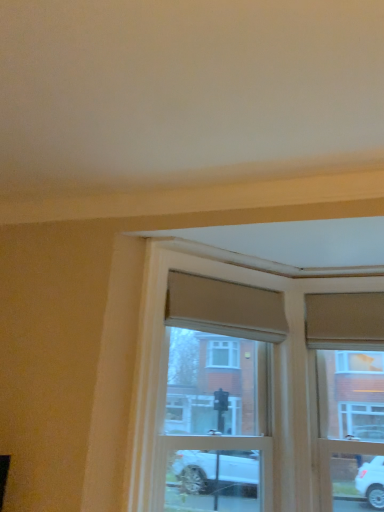
What is the approximate width of wooden window frame at upper right?

The width of wooden window frame at upper right is 7.80 inches.

At what (x,y) coordinates should I click in order to perform the action: click on wooden window frame at upper right. Please return your answer as a coordinate pair (x, y). Looking at the image, I should click on (350, 430).

What do you see at coordinates (350, 430) in the screenshot? This screenshot has width=384, height=512. I see `wooden window frame at upper right` at bounding box center [350, 430].

The image size is (384, 512). What are the coordinates of `wooden window frame at center` in the screenshot? It's located at (275, 368).

The height and width of the screenshot is (512, 384). What do you see at coordinates (275, 368) in the screenshot?
I see `wooden window frame at center` at bounding box center [275, 368].

You are a GUI agent. You are given a task and a screenshot of the screen. Output one action in this format:
    pyautogui.click(x=<x>, y=<y>)
    Task: Click on the wooden window frame at upper right
    
    Given the screenshot: What is the action you would take?
    pyautogui.click(x=350, y=430)

Would you say wooden window frame at upper right is to the left or to the right of wooden window frame at center in the picture?

Clearly, wooden window frame at upper right is on the right of wooden window frame at center in the image.

Between wooden window frame at upper right and wooden window frame at center, which one is positioned behind?

wooden window frame at upper right is further from the camera.

Is point (328, 395) in front of point (288, 490)?

That is False.

From the image's perspective, is wooden window frame at upper right beneath wooden window frame at center?

Correct, wooden window frame at upper right appears lower than wooden window frame at center in the image.

From a real-world perspective, is wooden window frame at upper right physically located above or below wooden window frame at center?

From a real-world perspective, wooden window frame at upper right is physically above wooden window frame at center.

Considering the sizes of wooden window frame at upper right and wooden window frame at center in the image, is wooden window frame at upper right wider or thinner than wooden window frame at center?

wooden window frame at upper right is thinner than wooden window frame at center.

Is wooden window frame at upper right shorter than wooden window frame at center?

Yes.

Considering the sizes of objects wooden window frame at upper right and wooden window frame at center in the image provided, who is bigger, wooden window frame at upper right or wooden window frame at center?

Bigger between the two is wooden window frame at center.

Is wooden window frame at center inside wooden window frame at upper right?

No, wooden window frame at center is not a part of wooden window frame at upper right.

Looking at this image, can you see wooden window frame at upper right touching wooden window frame at center?

There is a gap between wooden window frame at upper right and wooden window frame at center.

Is wooden window frame at upper right facing towards wooden window frame at center?

No, wooden window frame at upper right does not turn towards wooden window frame at center.

How different are the orientations of wooden window frame at upper right and wooden window frame at center in degrees?

The angle between the facing direction of wooden window frame at upper right and the facing direction of wooden window frame at center is 47.9 degrees.

How distant is wooden window frame at upper right from wooden window frame at center?

wooden window frame at upper right and wooden window frame at center are 38.46 centimeters apart.

This screenshot has width=384, height=512. I want to click on window beneath the wooden window frame at upper right (from a real-world perspective), so click(x=275, y=368).

Considering the relative positions of wooden window frame at center and wooden window frame at upper right in the image provided, is wooden window frame at center to the right of wooden window frame at upper right from the viewer's perspective?

Incorrect, wooden window frame at center is not on the right side of wooden window frame at upper right.

Is wooden window frame at center in front of or behind wooden window frame at upper right in the image?

wooden window frame at center is positioned closer to the viewer than wooden window frame at upper right.

Does point (294, 359) lie behind point (367, 396)?

Yes, point (294, 359) is farther from viewer.

From the image's perspective, is wooden window frame at center on top of wooden window frame at upper right?

Indeed, from the image's perspective, wooden window frame at center is shown above wooden window frame at upper right.

From a real-world perspective, between wooden window frame at center and wooden window frame at upper right, who is vertically lower?

From a 3D spatial view, wooden window frame at center is below.

Which of these two, wooden window frame at center or wooden window frame at upper right, is thinner?

Thinner between the two is wooden window frame at upper right.

Looking at this image, considering the relative sizes of wooden window frame at center and wooden window frame at upper right in the image provided, is wooden window frame at center taller than wooden window frame at upper right?

Correct, wooden window frame at center is much taller as wooden window frame at upper right.

Who is bigger, wooden window frame at center or wooden window frame at upper right?

With larger size is wooden window frame at center.

Is wooden window frame at center situated inside wooden window frame at upper right or outside?

wooden window frame at center exists outside the volume of wooden window frame at upper right.

Are wooden window frame at center and wooden window frame at upper right making contact?

No, wooden window frame at center is not beside wooden window frame at upper right.

In the scene shown: Is wooden window frame at center oriented towards wooden window frame at upper right?

No.

How many degrees apart are the facing directions of wooden window frame at center and wooden window frame at upper right?

There is a 47.9-degree angle between the facing directions of wooden window frame at center and wooden window frame at upper right.

You are a GUI agent. You are given a task and a screenshot of the screen. Output one action in this format:
    pyautogui.click(x=<x>, y=<y>)
    Task: Click on the window frame that appears below the wooden window frame at center (from the image's perspective)
    This screenshot has height=512, width=384.
    Given the screenshot: What is the action you would take?
    pyautogui.click(x=350, y=430)

I want to click on window that appears on the left of wooden window frame at upper right, so click(x=275, y=368).

This screenshot has height=512, width=384. I want to click on window frame that appears above the wooden window frame at center (from a real-world perspective), so click(350, 430).